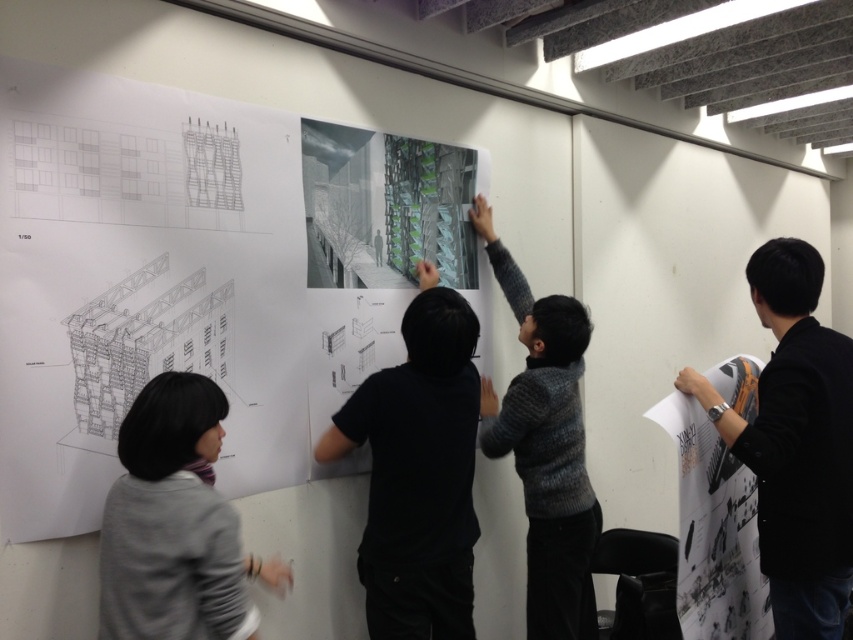
The height and width of the screenshot is (640, 853). I want to click on gray sweater at lower left, so click(175, 524).

Is point (131, 605) farther from camera compared to point (575, 513)?

No.

Identify the location of gray sweater at lower left. The height and width of the screenshot is (640, 853). (175, 524).

The width and height of the screenshot is (853, 640). What are the coordinates of `gray sweater at lower left` in the screenshot? It's located at (175, 524).

Who is shorter, black matte shirt at center or gray knitted sweater at upper center?

Standing shorter between the two is black matte shirt at center.

Is black matte shirt at center behind gray knitted sweater at upper center?

No, it is not.

Which is behind, point (457, 433) or point (508, 291)?

Positioned behind is point (508, 291).

This screenshot has width=853, height=640. Identify the location of black matte shirt at center. (418, 472).

Does white paper architectural drawing at upper center lie behind black fabric at right?

No.

Is white paper architectural drawing at upper center to the left of black fabric at right from the viewer's perspective?

Yes, white paper architectural drawing at upper center is to the left of black fabric at right.

What do you see at coordinates (200, 275) in the screenshot? The width and height of the screenshot is (853, 640). I see `white paper architectural drawing at upper center` at bounding box center [200, 275].

At what (x,y) coordinates should I click in order to perform the action: click on white paper architectural drawing at upper center. Please return your answer as a coordinate pair (x, y). Image resolution: width=853 pixels, height=640 pixels. Looking at the image, I should click on (200, 275).